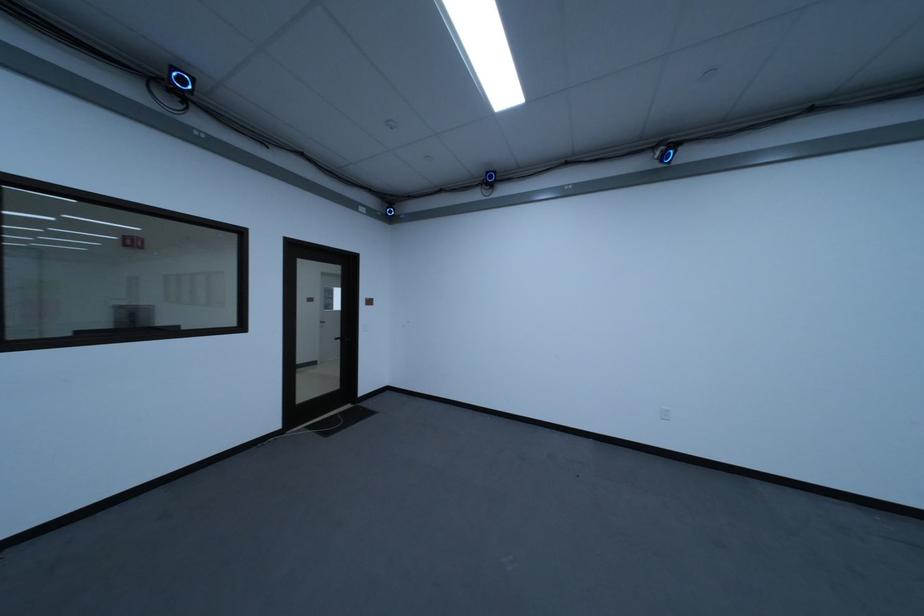
Identify the location of white light switch. (664, 413).